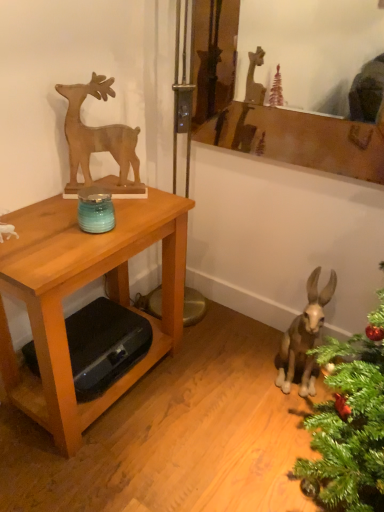
Locate an element on the screen. vacant point to the left of brown matte donkey at lower right is located at coordinates (250, 382).